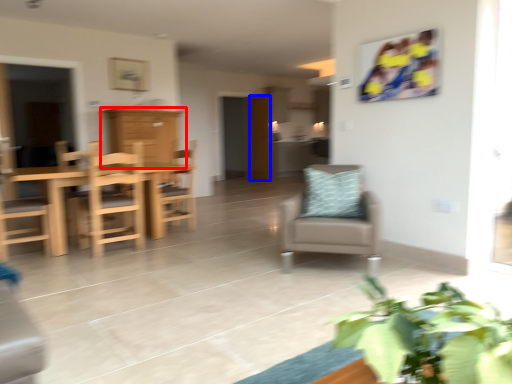
Question: Which object is closer to the camera taking this photo, cabinetry (highlighted by a red box) or door (highlighted by a blue box)?

Choices:
 (A) cabinetry
 (B) door

Answer: (A)